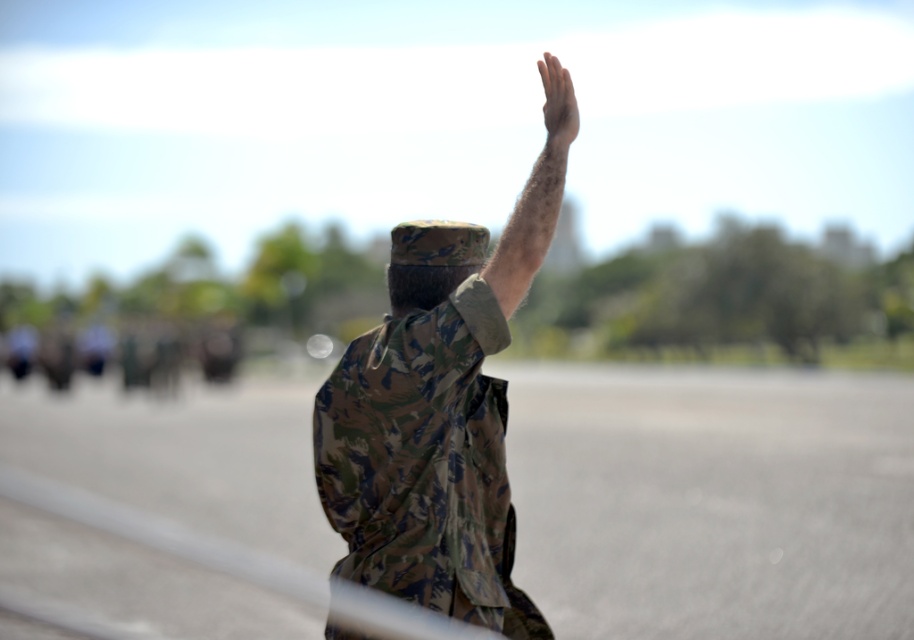
Can you confirm if hairy skin at upper center is positioned to the left of smooth skin hand at upper right?

Yes, hairy skin at upper center is to the left of smooth skin hand at upper right.

In the scene shown: Between hairy skin at upper center and smooth skin hand at upper right, which one appears on the left side from the viewer's perspective?

hairy skin at upper center is more to the left.

Image resolution: width=914 pixels, height=640 pixels. Find the location of `hairy skin at upper center`. hairy skin at upper center is located at coordinates (537, 195).

What are the coordinates of `hairy skin at upper center` in the screenshot? It's located at (537, 195).

Does camo fabric uniform at center have a lesser width compared to hairy skin at upper center?

No, camo fabric uniform at center is not thinner than hairy skin at upper center.

How far apart are camo fabric uniform at center and hairy skin at upper center?

camo fabric uniform at center is 13.64 inches from hairy skin at upper center.

Who is more distant from viewer, (423, 442) or (528, 212)?

The point (423, 442) is more distant.

Find the location of a particular element. The width and height of the screenshot is (914, 640). camo fabric uniform at center is located at coordinates (432, 412).

Does camo fabric uniform at center have a smaller size compared to smooth skin hand at upper right?

No, camo fabric uniform at center is not smaller than smooth skin hand at upper right.

Which of these two, camo fabric uniform at center or smooth skin hand at upper right, stands taller?

With more height is camo fabric uniform at center.

Identify the location of camo fabric uniform at center. The width and height of the screenshot is (914, 640). (432, 412).